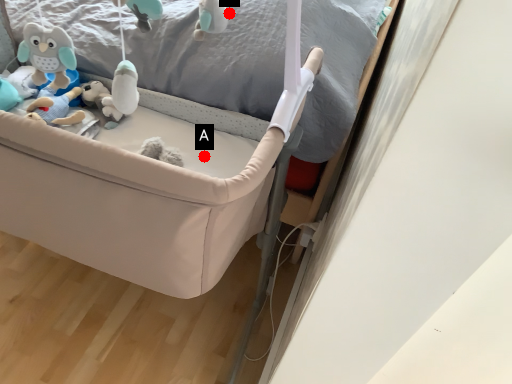
Question: Two points are circled on the image, labeled by A and B beside each circle. Which point is closer to the camera?

Choices:
 (A) A is closer
 (B) B is closer

Answer: (A)